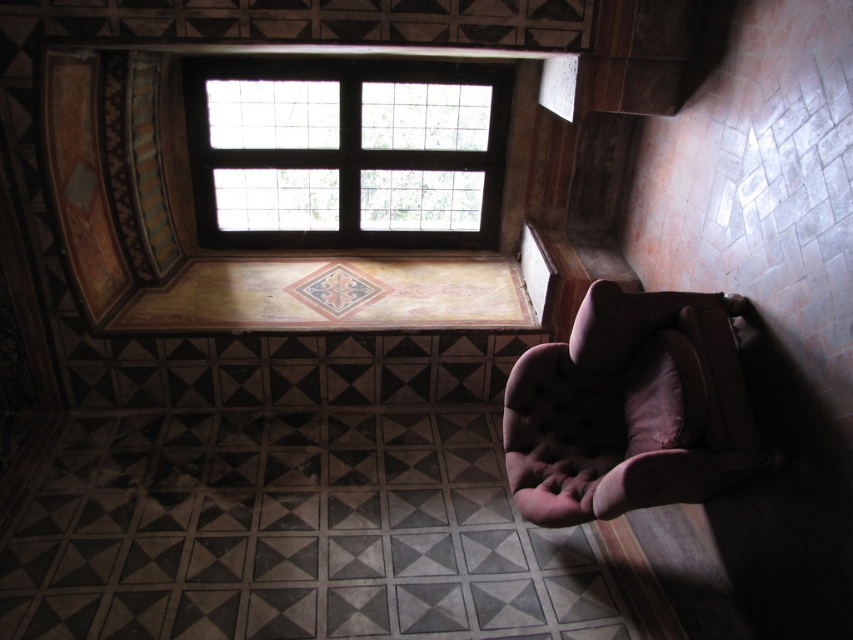
Question: Is wooden grid window at upper center closer to camera compared to velvet brown armchair at lower right?

Choices:
 (A) yes
 (B) no

Answer: (B)

Question: Which object is closer to the camera taking this photo?

Choices:
 (A) velvet brown armchair at lower right
 (B) wooden grid window at upper center

Answer: (A)

Question: Which object appears closest to the camera in this image?

Choices:
 (A) velvet brown armchair at lower right
 (B) wooden grid window at upper center

Answer: (A)

Question: Among these points, which one is farthest from the camera?

Choices:
 (A) (701, 369)
 (B) (260, 134)

Answer: (B)

Question: Can you confirm if wooden grid window at upper center is positioned below velvet brown armchair at lower right?

Choices:
 (A) no
 (B) yes

Answer: (A)

Question: Can you confirm if wooden grid window at upper center is wider than velvet brown armchair at lower right?

Choices:
 (A) yes
 (B) no

Answer: (A)